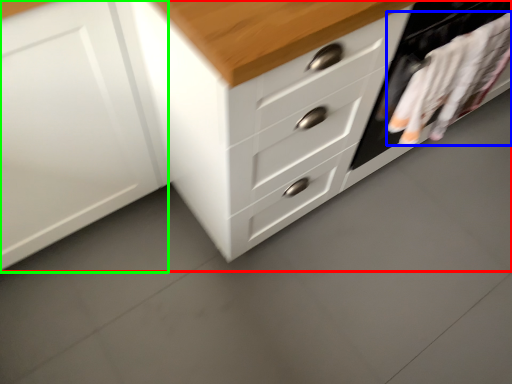
Question: Estimate the real-world distances between objects in this image. Which object is closer to chest of drawers (highlighted by a red box), laundry (highlighted by a blue box) or cabinetry (highlighted by a green box)?

Choices:
 (A) laundry
 (B) cabinetry

Answer: (B)